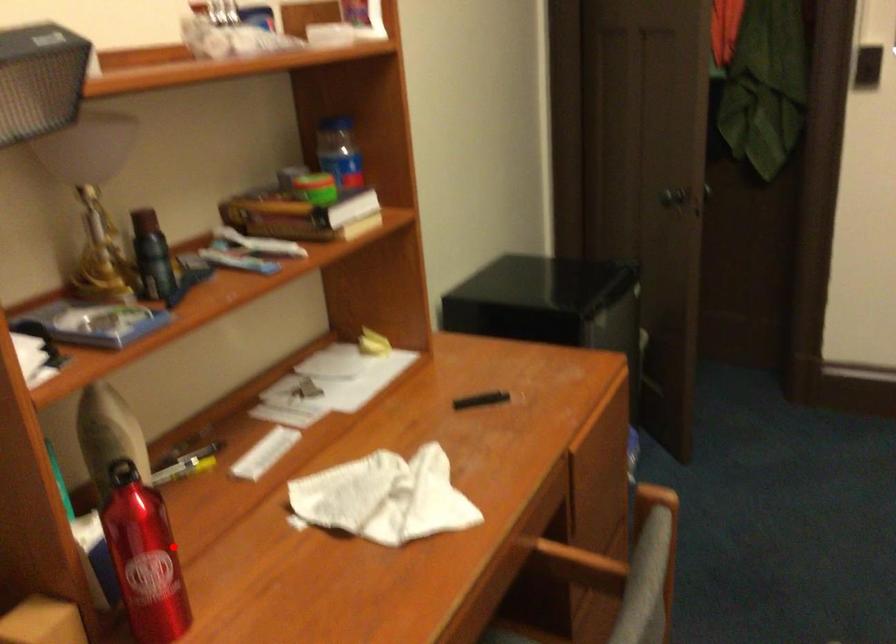
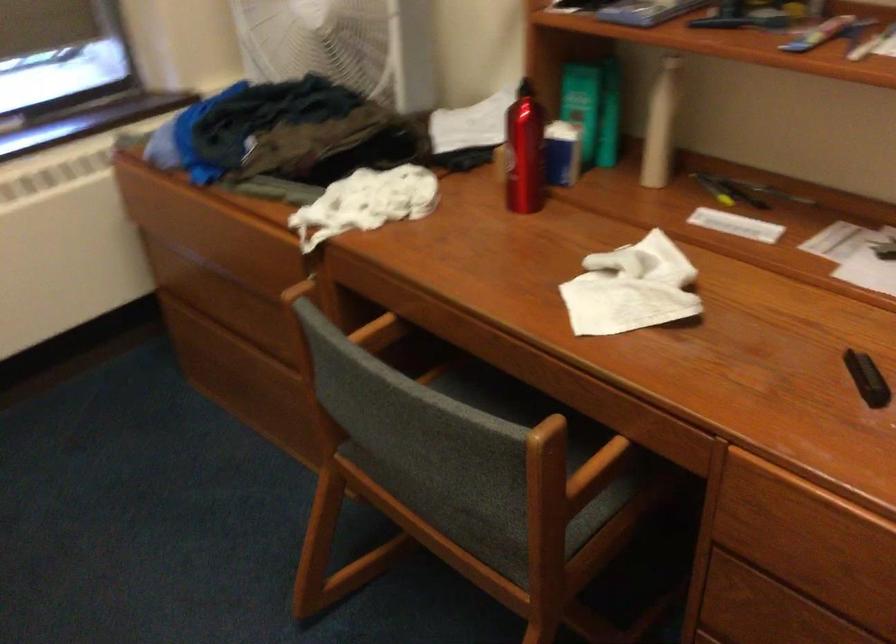
The point at the highlighted location is marked in the first image. Where is the corresponding point in the second image?

(524, 152)